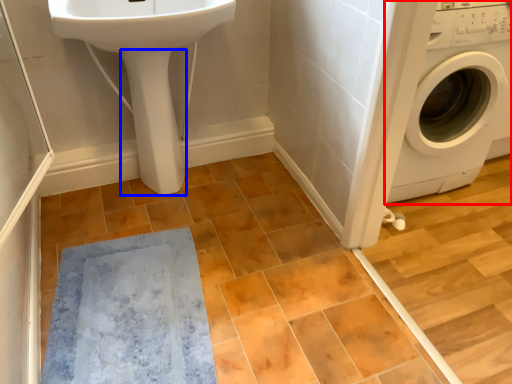
Question: Which object is closer to the camera taking this photo, washing machine (highlighted by a red box) or bidet (highlighted by a blue box)?

Choices:
 (A) washing machine
 (B) bidet

Answer: (A)